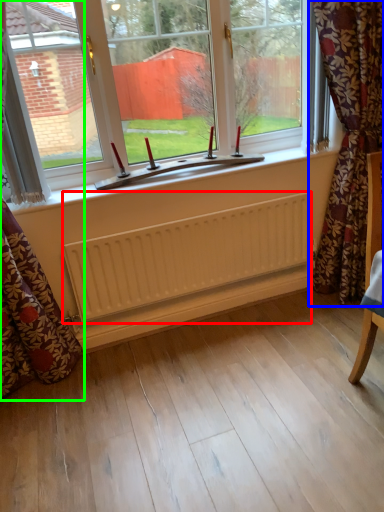
Question: Estimate the real-world distances between objects in this image. Which object is closer to radiator (highlighted by a red box), curtain (highlighted by a blue box) or curtain (highlighted by a green box)?

Choices:
 (A) curtain
 (B) curtain

Answer: (B)